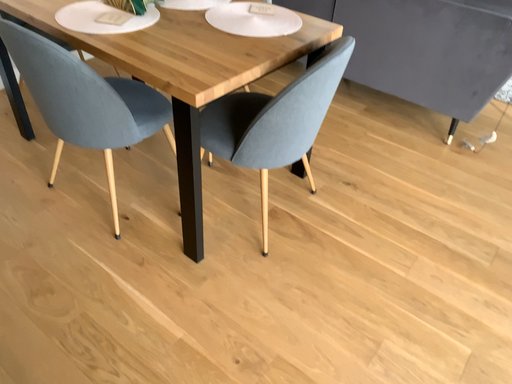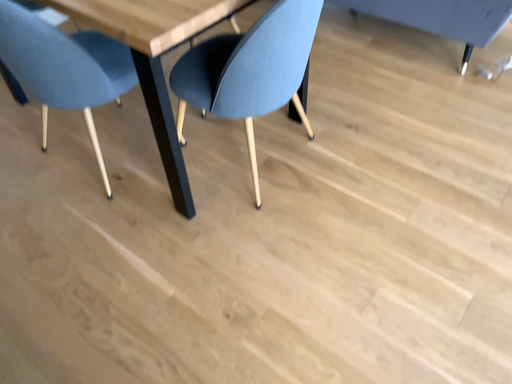
Question: How did the camera likely rotate when shooting the video?

Choices:
 (A) rotated upward
 (B) rotated downward

Answer: (B)